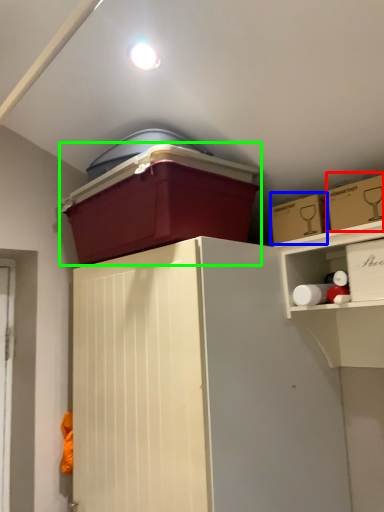
Question: Which object is positioned farthest from storage box (highlighted by a red box)? Select from storage box (highlighted by a blue box) and storage box (highlighted by a green box).

Choices:
 (A) storage box
 (B) storage box

Answer: (B)